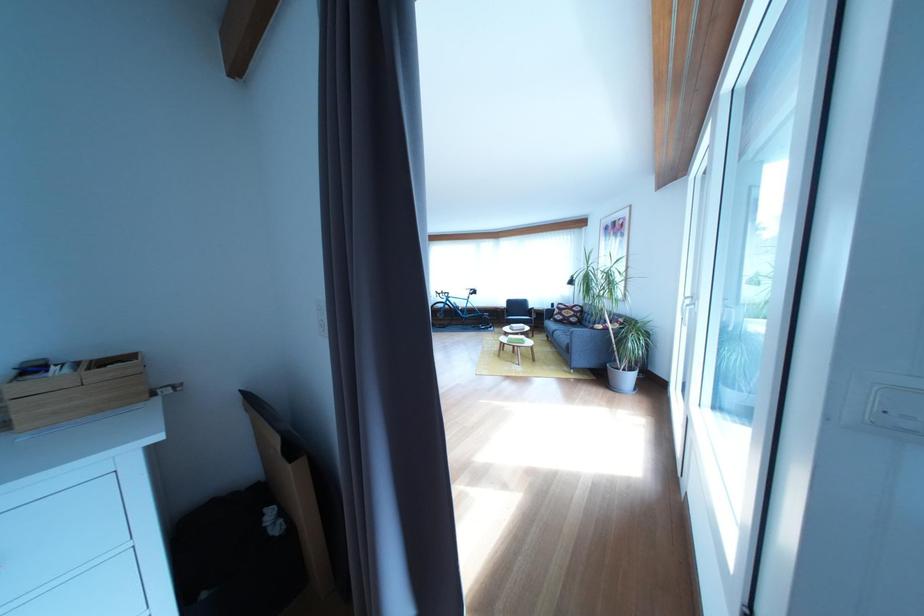
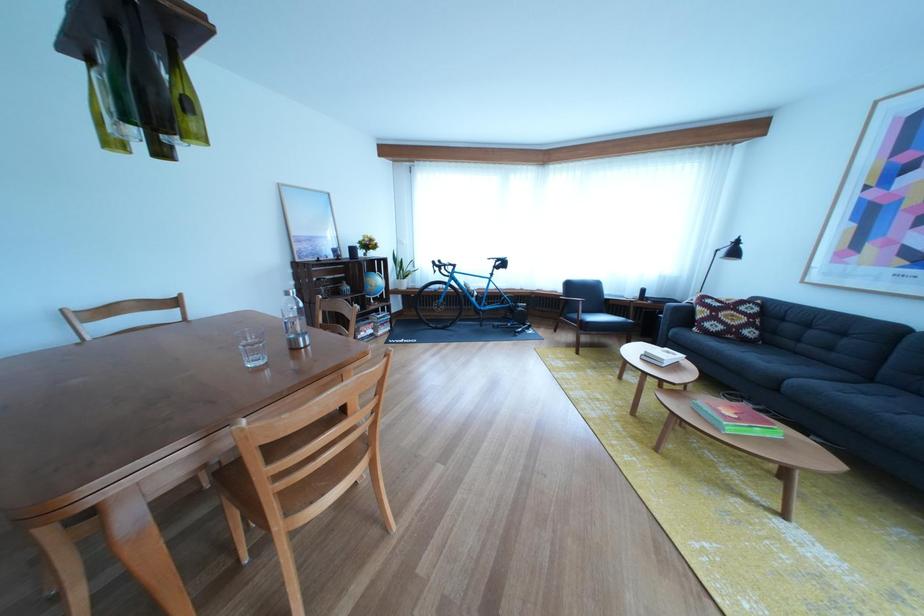
Question: Which direction would the cameraman need to move to produce the second image? Reply with the corresponding letter.

Choices:
 (A) Left
 (B) Right
 (C) Forward
 (D) Backward

Answer: (C)